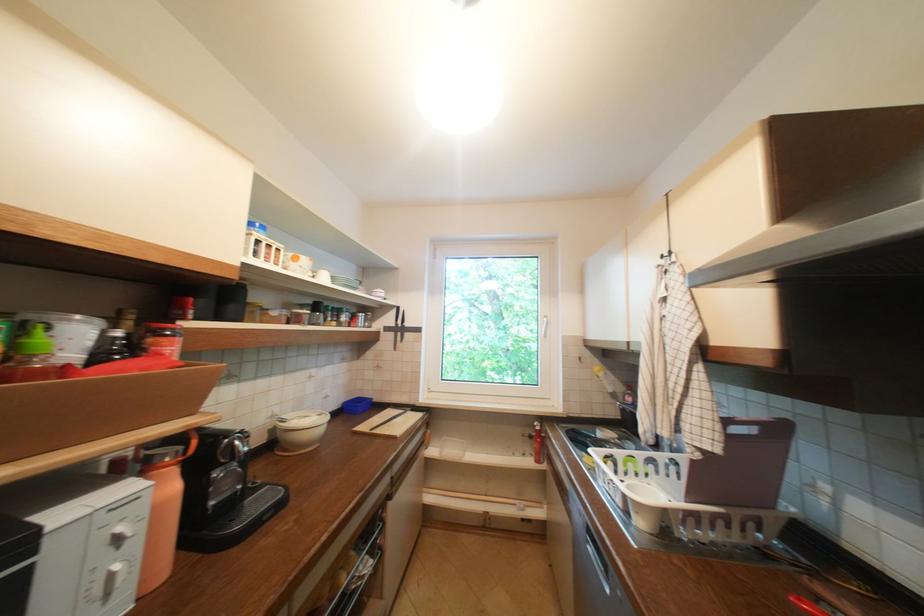
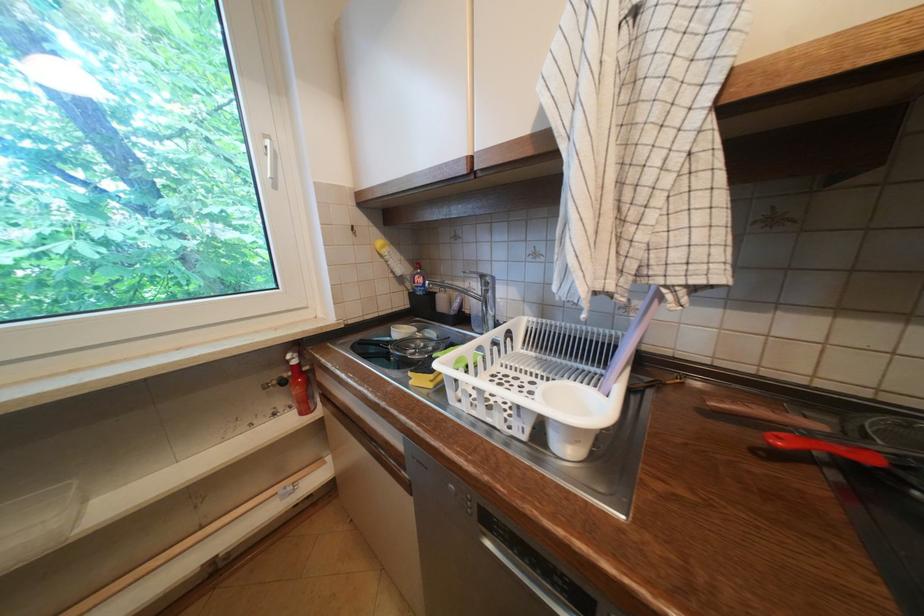
The point at (553,322) is marked in the first image. Where is the corresponding point in the second image?

(274, 148)